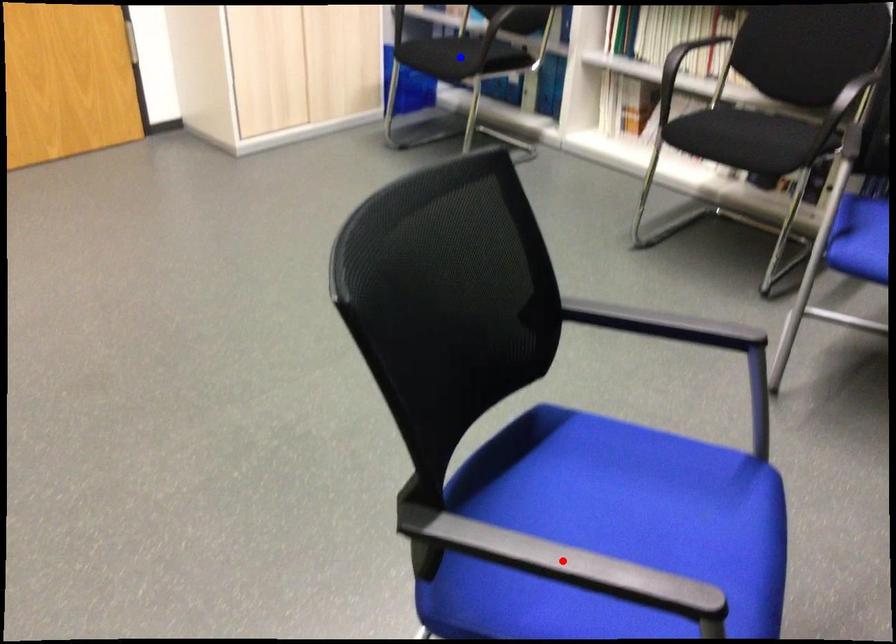
Question: Two points are marked on the image. Which point is closer to the camera?

Choices:
 (A) Blue point is closer.
 (B) Red point is closer.

Answer: (B)